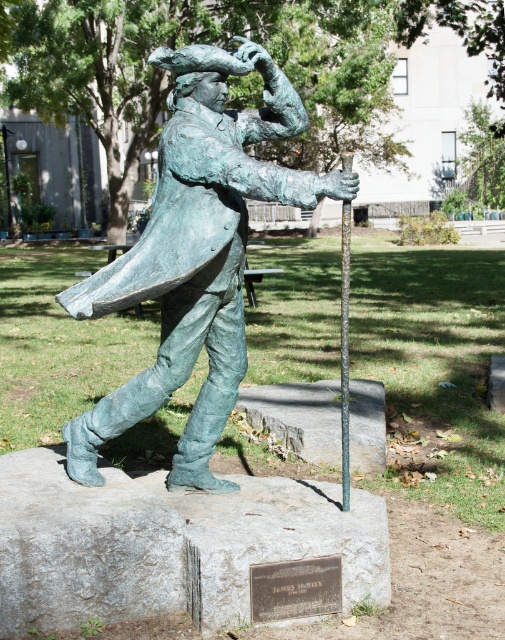
Question: Can you confirm if green patina bronze statue at center is thinner than green patina pole at center?

Choices:
 (A) yes
 (B) no

Answer: (A)

Question: Does green patina bronze statue at center lie in front of green patina pole at center?

Choices:
 (A) no
 (B) yes

Answer: (B)

Question: Is green patina bronze statue at center positioned in front of green patina pole at center?

Choices:
 (A) no
 (B) yes

Answer: (B)

Question: Among these objects, which one is farthest from the camera?

Choices:
 (A) green patina pole at center
 (B) green patina bronze statue at center

Answer: (A)

Question: Which point is farther to the camera?

Choices:
 (A) (345, 228)
 (B) (211, 170)

Answer: (A)